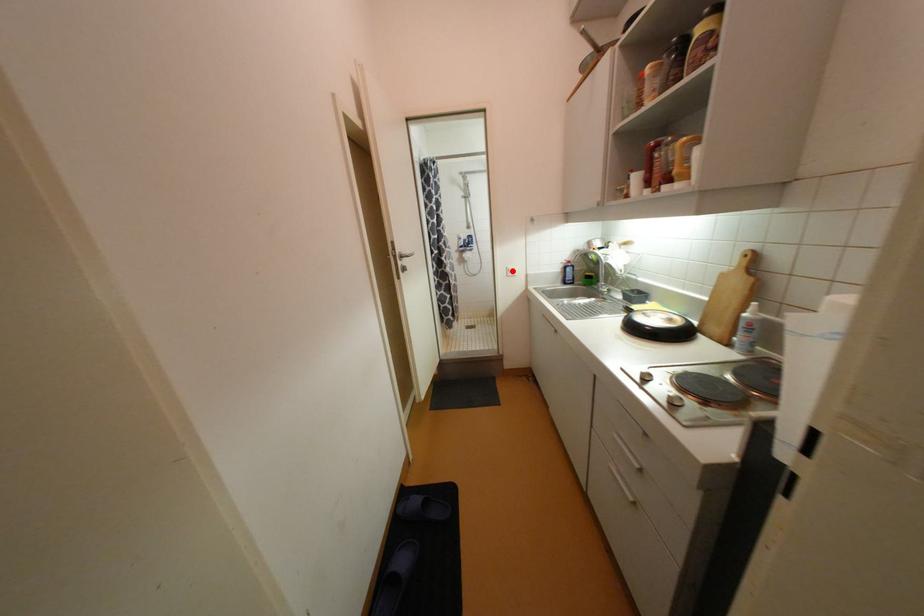
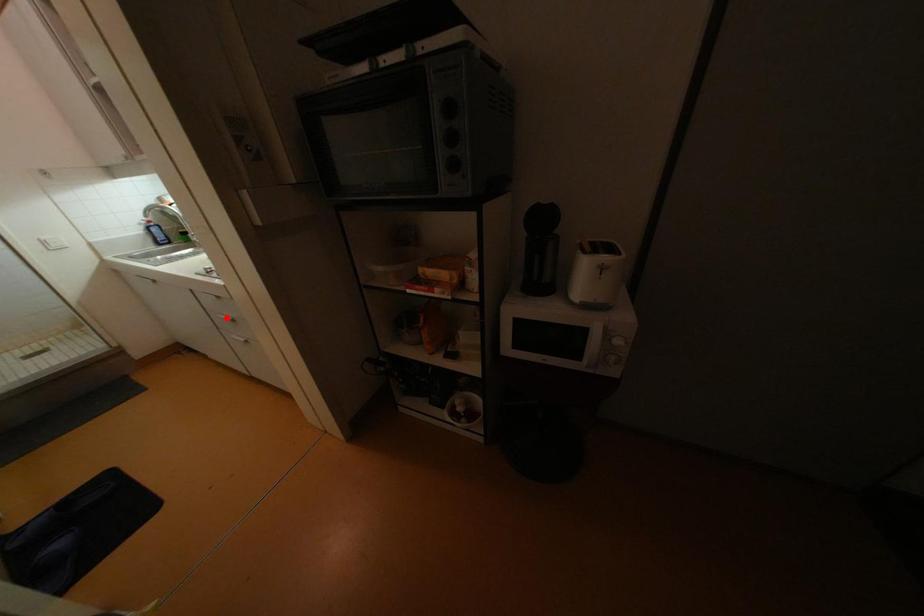
I am providing you with two images of the same scene from different viewpoints. A red point is marked on the first image and another point is marked on the second image. Do the highlighted points in image1 and image2 indicate the same real-world spot?

No